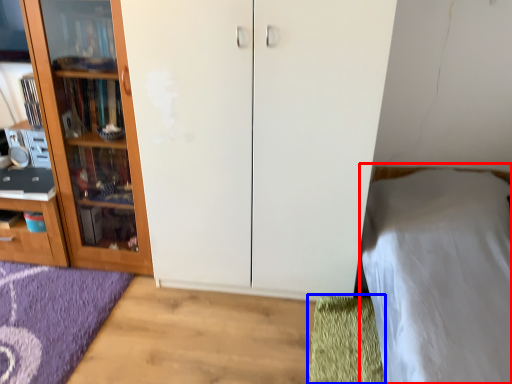
Question: Which of the following is the farthest to the observer, bed (highlighted by a red box) or doormat (highlighted by a blue box)?

Choices:
 (A) bed
 (B) doormat

Answer: (B)